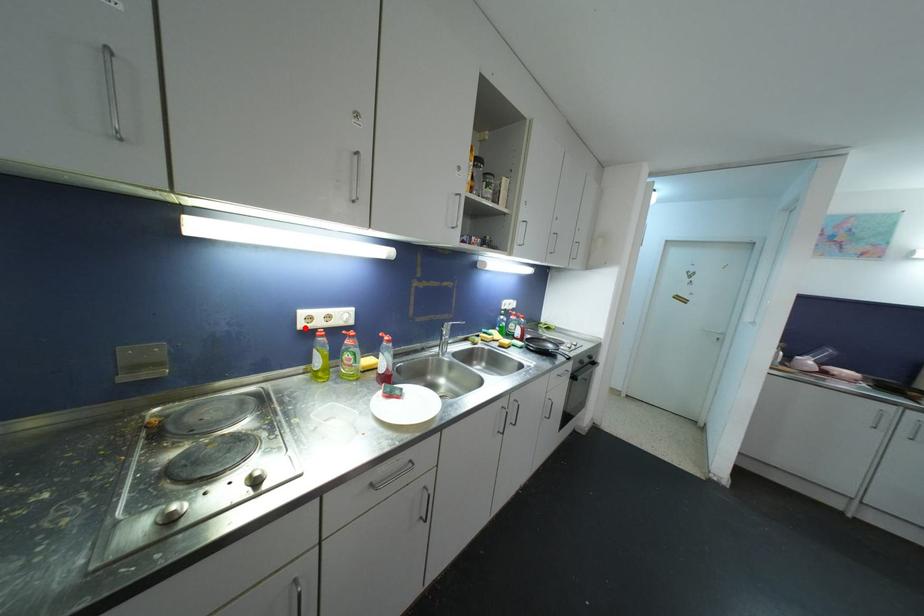
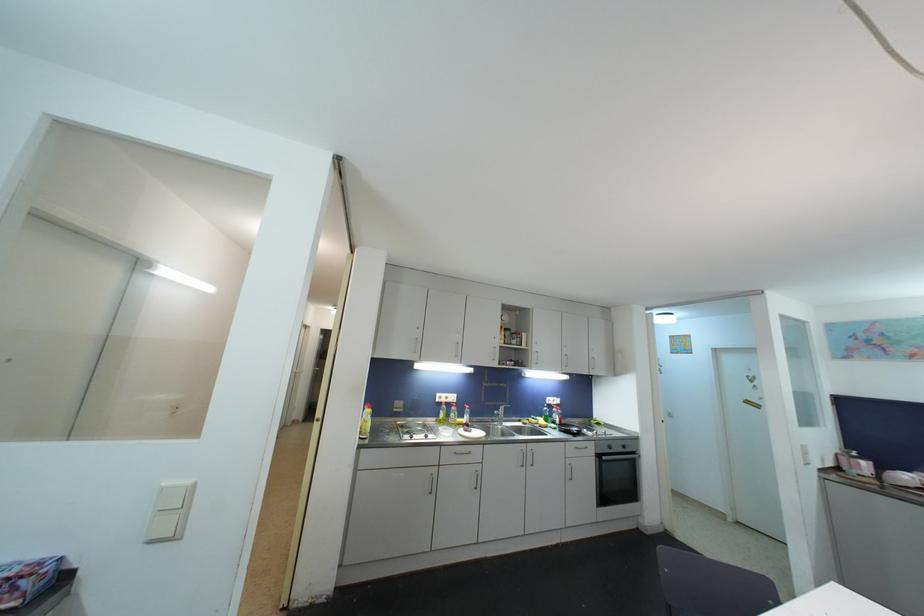
Question: I am providing you with two images of the same scene from different viewpoints. A red point is shown in image1. For the corresponding object point in image2, is it positioned nearer or farther from the camera?

Choices:
 (A) Nearer
 (B) Farther

Answer: (B)